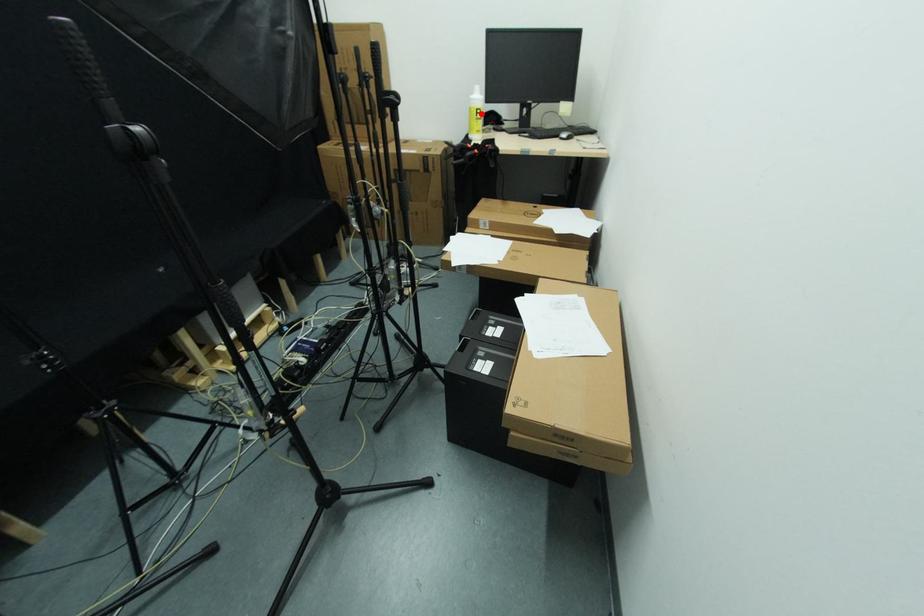
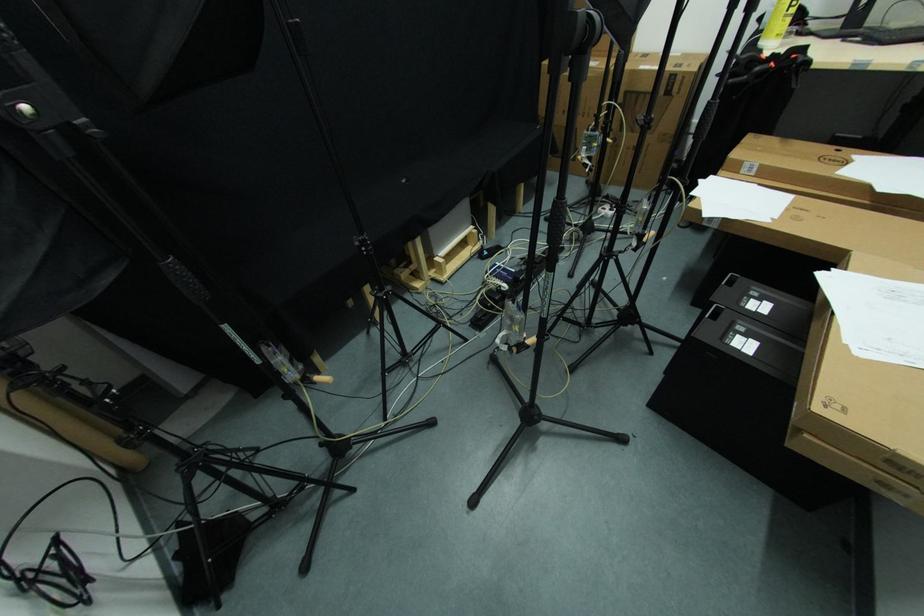
Find the pixel in the second image that matches the highlighted location in the first image.

(796, 6)